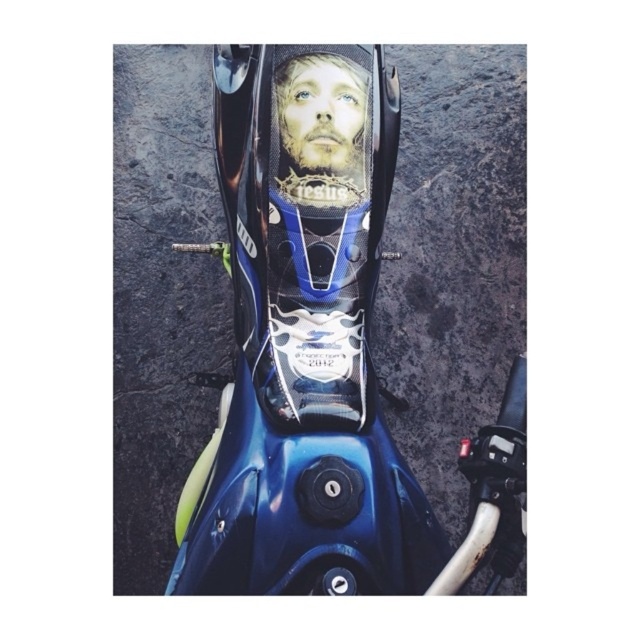
Is glossy carbon fiber motorcycle at center positioned in front of smooth skin face at center?

Yes, it is in front of smooth skin face at center.

Is point (248, 400) behind point (294, 67)?

Yes, it is.

Describe the element at coordinates (323, 378) in the screenshot. The width and height of the screenshot is (640, 640). I see `glossy carbon fiber motorcycle at center` at that location.

Locate an element on the screen. glossy carbon fiber motorcycle at center is located at coordinates (323, 378).